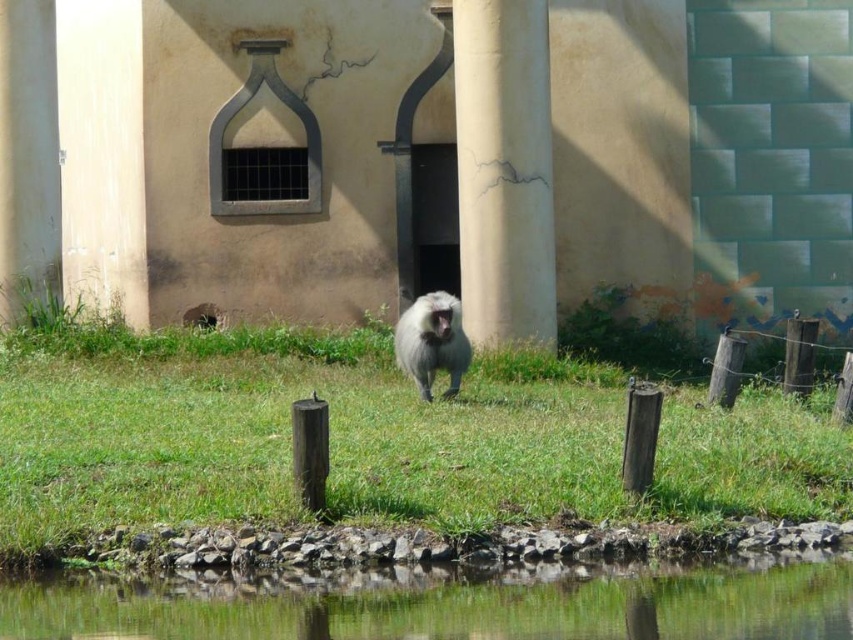
You are a GUI agent. You are given a task and a screenshot of the screen. Output one action in this format:
    pyautogui.click(x=<x>, y=<y>)
    Task: Click on the clear water at lower center
    This screenshot has width=853, height=640.
    Given the screenshot: What is the action you would take?
    pyautogui.click(x=445, y=605)

This screenshot has height=640, width=853. Describe the element at coordinates (445, 605) in the screenshot. I see `clear water at lower center` at that location.

At what (x,y) coordinates should I click in order to perform the action: click on clear water at lower center. Please return your answer as a coordinate pair (x, y). The image size is (853, 640). Looking at the image, I should click on (445, 605).

Does green grass at center have a greater height compared to smooth concrete pillar at center?

No.

Which is in front, point (744, 454) or point (514, 275)?

Positioned in front is point (744, 454).

Is point (610, 440) farther from camera compared to point (515, 333)?

No.

The width and height of the screenshot is (853, 640). Identify the location of green grass at center. (370, 438).

Does green grass at center appear on the right side of clear water at lower center?

In fact, green grass at center is to the left of clear water at lower center.

Can you confirm if green grass at center is thinner than clear water at lower center?

Incorrect, green grass at center's width is not less than clear water at lower center's.

Describe the element at coordinates (370, 438) in the screenshot. Image resolution: width=853 pixels, height=640 pixels. I see `green grass at center` at that location.

This screenshot has height=640, width=853. Identify the location of green grass at center. point(370,438).